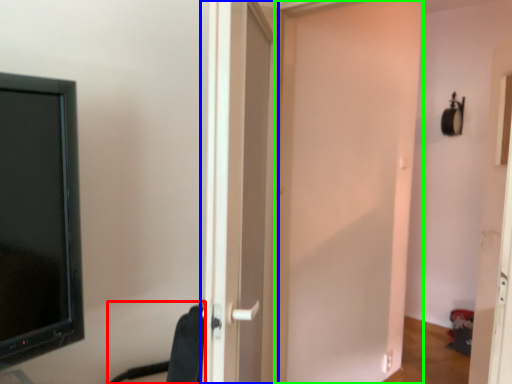
Question: Which is farther away from swivel chair (highlighted by a red box)? door (highlighted by a blue box) or door (highlighted by a green box)?

Choices:
 (A) door
 (B) door

Answer: (B)